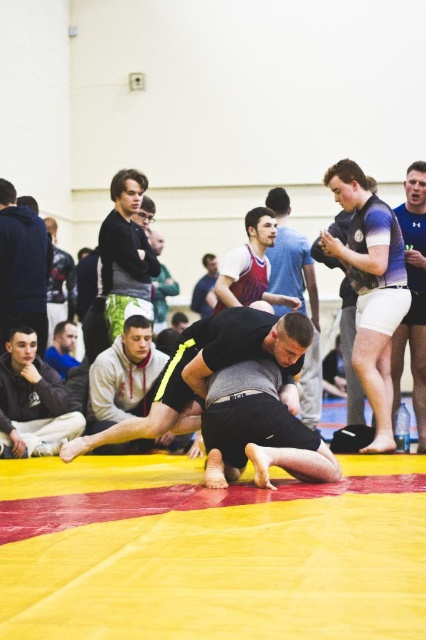
Question: Which point is closer to the camera?

Choices:
 (A) matte black wrestling mat at center
 (B) white matte shorts at right
 (C) black leather jacket at upper left

Answer: (B)

Question: Does white matte shorts at right lie behind matte red athletic shorts at center?

Choices:
 (A) yes
 (B) no

Answer: (B)

Question: Is matte black vest at upper right positioned at the back of matte blue shirt at upper left?

Choices:
 (A) no
 (B) yes

Answer: (A)

Question: Which of the following is the closest to the observer?

Choices:
 (A) matte red athletic shorts at center
 (B) matte black vest at upper right
 (C) matte blue shirt at upper left

Answer: (B)

Question: Is dark gray hoodie at upper left bigger than matte blue shirt at upper left?

Choices:
 (A) yes
 (B) no

Answer: (A)

Question: Among these objects, which one is farthest from the camera?

Choices:
 (A) white matte shorts at right
 (B) black leather jacket at upper left
 (C) black matte shorts at center

Answer: (B)